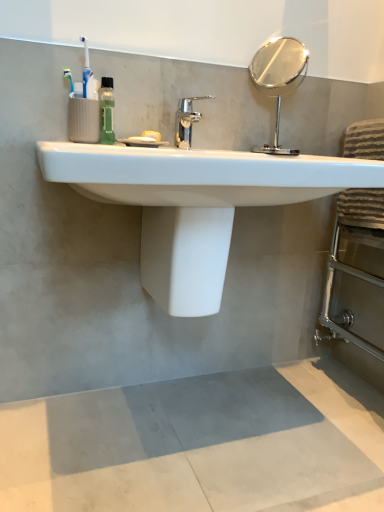
Measure the distance between white glossy sink at center and camera.

white glossy sink at center and camera are 29.35 inches apart.

What do you see at coordinates (186, 120) in the screenshot? I see `chrome metallic faucet at center` at bounding box center [186, 120].

Where is `brown striped towel at right`? brown striped towel at right is located at coordinates (361, 207).

From the image's perspective, is green translucent bottle at upper left above or below chrome metallic faucet at center?

Clearly, from the image's perspective, green translucent bottle at upper left is above chrome metallic faucet at center.

Locate an element on the screen. This screenshot has width=384, height=512. mouthwash on the left of chrome metallic faucet at center is located at coordinates (106, 111).

Can you confirm if green translucent bottle at upper left is taller than chrome metallic faucet at center?

Correct, green translucent bottle at upper left is much taller as chrome metallic faucet at center.

From the image's perspective, would you say green translucent bottle at upper left is positioned over brown striped towel at right?

Yes.

Is green translucent bottle at upper left looking in the opposite direction of brown striped towel at right?

No, green translucent bottle at upper left is not facing the opposite direction of brown striped towel at right.

Considering the relative sizes of green translucent bottle at upper left and brown striped towel at right in the image provided, is green translucent bottle at upper left smaller than brown striped towel at right?

Yes, green translucent bottle at upper left is smaller than brown striped towel at right.

Between green translucent bottle at upper left and brown striped towel at right, which one appears on the left side from the viewer's perspective?

green translucent bottle at upper left is more to the left.

Which of these two, brown striped towel at right or white glossy sink at center, is smaller?

brown striped towel at right is smaller.

What are the coordinates of `bath towel above the white glossy sink at center (from the image's perspective)` in the screenshot? It's located at (361, 207).

Based on the photo, is brown striped towel at right wider than white glossy sink at center?

In fact, brown striped towel at right might be narrower than white glossy sink at center.

Considering the points (353, 124) and (45, 165), which point is in front, point (353, 124) or point (45, 165)?

The point (45, 165) is closer to the camera.

Is white glossy sink at center with polished silver mirror at upper right?

No, white glossy sink at center is not beside polished silver mirror at upper right.

How different are the orientations of white glossy sink at center and polished silver mirror at upper right in degrees?

1.82 degrees separate the facing orientations of white glossy sink at center and polished silver mirror at upper right.

How distant is white glossy sink at center from polished silver mirror at upper right?

white glossy sink at center is 5.96 feet from polished silver mirror at upper right.

Would you say white glossy sink at center is outside polished silver mirror at upper right?

Absolutely, white glossy sink at center is external to polished silver mirror at upper right.

From the image's perspective, is gray concrete mat at lower center on top of white glossy toilet bowl at center?

No, from the image's perspective, gray concrete mat at lower center is not on top of white glossy toilet bowl at center.

Is gray concrete mat at lower center positioned with its back to white glossy toilet bowl at center?

No, gray concrete mat at lower center is not facing away from white glossy toilet bowl at center.

Is gray concrete mat at lower center not near white glossy toilet bowl at center?

No.

Considering the sizes of objects chrome metallic faucet at center and polished silver mirror at upper right in the image provided, who is taller, chrome metallic faucet at center or polished silver mirror at upper right?

Standing taller between the two is polished silver mirror at upper right.

Considering the relative sizes of chrome metallic faucet at center and polished silver mirror at upper right in the image provided, is chrome metallic faucet at center thinner than polished silver mirror at upper right?

No.

Looking at the image, does chrome metallic faucet at center seem bigger or smaller compared to polished silver mirror at upper right?

Considering their sizes, chrome metallic faucet at center takes up less space than polished silver mirror at upper right.

The image size is (384, 512). In order to click on tap in front of the polished silver mirror at upper right in this screenshot , I will do `click(186, 120)`.

From the image's perspective, does green translucent bottle at upper left appear higher than white glossy toilet bowl at center?

Correct, green translucent bottle at upper left appears higher than white glossy toilet bowl at center in the image.

Is green translucent bottle at upper left wider than white glossy toilet bowl at center?

In fact, green translucent bottle at upper left might be narrower than white glossy toilet bowl at center.

How distant is green translucent bottle at upper left from white glossy toilet bowl at center?

green translucent bottle at upper left is 39.22 centimeters away from white glossy toilet bowl at center.

Between point (114, 100) and point (216, 249), which one is positioned behind?

The point (114, 100) is behind.

The image size is (384, 512). What are the coordinates of `tap to the right of green translucent bottle at upper left` in the screenshot? It's located at (186, 120).

The image size is (384, 512). I want to click on bath towel that appears below the green translucent bottle at upper left (from a real-world perspective), so click(x=361, y=207).

From the picture: When comparing their distances from polished silver mirror at upper right, does gray concrete mat at lower center or brown striped towel at right seem closer?

brown striped towel at right is positioned closer to the anchor polished silver mirror at upper right.

Estimate the real-world distances between objects in this image. Which object is further from white glossy sink at center, polished silver mirror at upper right or chrome metallic faucet at center?

Based on the image, polished silver mirror at upper right appears to be further to white glossy sink at center.

Looking at the image, which one is located closer to polished silver mirror at upper right, green translucent bottle at upper left or white glossy toilet bowl at center?

green translucent bottle at upper left is closer to polished silver mirror at upper right.

Considering their positions, is gray concrete mat at lower center positioned further to white glossy toilet bowl at center than brown striped towel at right?

Among the two, brown striped towel at right is located further to white glossy toilet bowl at center.

When comparing their distances from brown striped towel at right, does white glossy toilet bowl at center or gray concrete mat at lower center seem further?

gray concrete mat at lower center is further to brown striped towel at right.

Looking at the image, which one is located further to white glossy sink at center, gray concrete mat at lower center or green translucent bottle at upper left?

Based on the image, gray concrete mat at lower center appears to be further to white glossy sink at center.

Which object lies nearer to the anchor point polished silver mirror at upper right, white glossy sink at center or green translucent bottle at upper left?

green translucent bottle at upper left lies closer to polished silver mirror at upper right than the other object.

Consider the image. Considering their positions, is white glossy toilet bowl at center positioned further to gray concrete mat at lower center than chrome metallic faucet at center?

chrome metallic faucet at center is positioned further to the anchor gray concrete mat at lower center.

Find the location of a particular element. This screenshot has height=512, width=384. tap between polished silver mirror at upper right and gray concrete mat at lower center in the vertical direction is located at coordinates (186, 120).

I want to click on toilet bowl between polished silver mirror at upper right and gray concrete mat at lower center from top to bottom, so click(185, 257).

The image size is (384, 512). What are the coordinates of `counter top between chrome metallic faucet at center and gray concrete mat at lower center from top to bottom` in the screenshot? It's located at (200, 175).

Where is `counter top that lies between polished silver mirror at upper right and gray concrete mat at lower center from top to bottom`? This screenshot has height=512, width=384. counter top that lies between polished silver mirror at upper right and gray concrete mat at lower center from top to bottom is located at coordinates (200, 175).